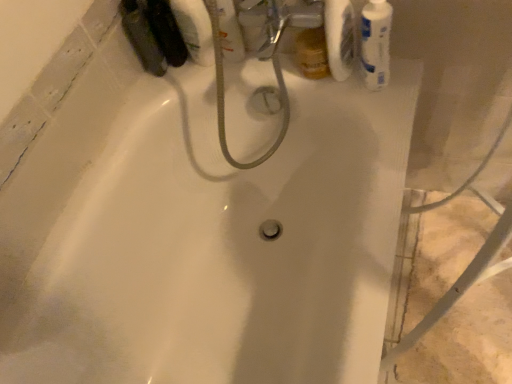
Question: Does white glossy mouthwash at upper right, arranged as the first mouthwash when viewed from the right, have a larger size compared to clear plastic bottle at upper center, marked as the 2th mouthwash in a left-to-right arrangement?

Choices:
 (A) yes
 (B) no

Answer: (A)

Question: Can you see white glossy mouthwash at upper right, arranged as the first mouthwash when viewed from the right, touching clear plastic bottle at upper center, marked as the 2th mouthwash in a left-to-right arrangement?

Choices:
 (A) yes
 (B) no

Answer: (B)

Question: Is white glossy mouthwash at upper right, the 3th mouthwash from the left, shorter than clear plastic bottle at upper center, marked as the 2th mouthwash in a left-to-right arrangement?

Choices:
 (A) yes
 (B) no

Answer: (B)

Question: Is white glossy mouthwash at upper right, the 3th mouthwash from the left, outside clear plastic bottle at upper center, marked as the 2th mouthwash in a left-to-right arrangement?

Choices:
 (A) yes
 (B) no

Answer: (A)

Question: Considering the relative positions of white glossy mouthwash at upper right, the 3th mouthwash from the left, and clear plastic bottle at upper center, which is the 2th mouthwash from right to left, in the image provided, is white glossy mouthwash at upper right, the 3th mouthwash from the left, to the right of clear plastic bottle at upper center, which is the 2th mouthwash from right to left, from the viewer's perspective?

Choices:
 (A) no
 (B) yes

Answer: (B)

Question: From a real-world perspective, relative to white matte toilet paper at upper right, is white glossy mouthwash at upper right, arranged as the first mouthwash when viewed from the right, vertically above or below?

Choices:
 (A) above
 (B) below

Answer: (B)

Question: Is white glossy mouthwash at upper right, arranged as the first mouthwash when viewed from the right, to the left or to the right of white matte toilet paper at upper right in the image?

Choices:
 (A) right
 (B) left

Answer: (A)

Question: Considering their positions, is white glossy mouthwash at upper right, the 3th mouthwash from the left, located in front of or behind white matte toilet paper at upper right?

Choices:
 (A) behind
 (B) front

Answer: (B)

Question: Looking at the image, does white glossy mouthwash at upper right, arranged as the first mouthwash when viewed from the right, seem bigger or smaller compared to white matte toilet paper at upper right?

Choices:
 (A) big
 (B) small

Answer: (A)

Question: Would you say white matte toilet paper at upper right is inside or outside matte black bottle at upper left, the third mouthwash in the right-to-left sequence?

Choices:
 (A) inside
 (B) outside

Answer: (B)

Question: Visually, is white matte toilet paper at upper right positioned to the left or to the right of matte black bottle at upper left, the 1th mouthwash in the left-to-right sequence?

Choices:
 (A) left
 (B) right

Answer: (B)

Question: Is white matte toilet paper at upper right taller or shorter than matte black bottle at upper left, the third mouthwash in the right-to-left sequence?

Choices:
 (A) tall
 (B) short

Answer: (A)

Question: Looking at their shapes, would you say white matte toilet paper at upper right is wider or thinner than matte black bottle at upper left, the 1th mouthwash in the left-to-right sequence?

Choices:
 (A) wide
 (B) thin

Answer: (B)

Question: In terms of width, does white glossy mouthwash at upper right, the 3th mouthwash from the left, look wider or thinner when compared to clear plastic bottle at upper center, which is the 2th mouthwash from right to left?

Choices:
 (A) wide
 (B) thin

Answer: (A)

Question: Does point (385, 66) appear closer or farther from the camera than point (242, 57)?

Choices:
 (A) farther
 (B) closer

Answer: (B)